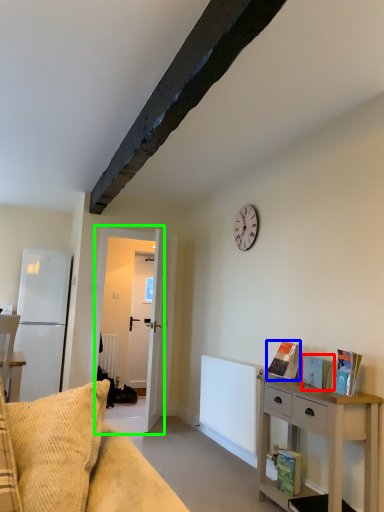
Question: Which is farther away from book (highlighted by a red box)? book (highlighted by a blue box) or door (highlighted by a green box)?

Choices:
 (A) book
 (B) door

Answer: (B)